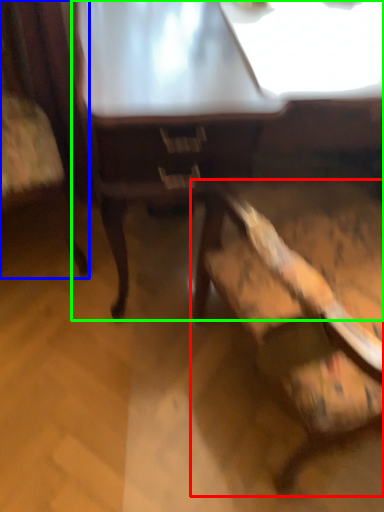
Question: Which is nearer to the chair (highlighted by a red box)? chair (highlighted by a blue box) or table (highlighted by a green box).

Choices:
 (A) chair
 (B) table

Answer: (B)